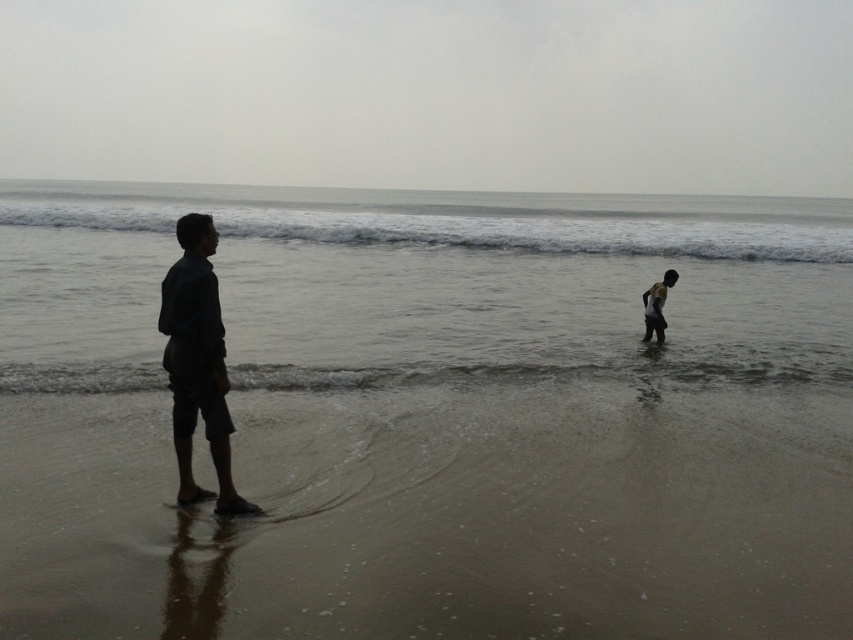
Is clear water at center positioned at the back of dark blue fabric shirt at left?

Yes, it is behind dark blue fabric shirt at left.

Can you confirm if clear water at center is smaller than dark blue fabric shirt at left?

Incorrect, clear water at center is not smaller in size than dark blue fabric shirt at left.

Is point (521, 349) farther from viewer compared to point (166, 349)?

Yes, it is behind point (166, 349).

Where is `clear water at center`? The image size is (853, 640). clear water at center is located at coordinates (422, 285).

Can you confirm if sandy beach at lower center is positioned below clear water at center?

Correct, sandy beach at lower center is located below clear water at center.

Between point (792, 522) and point (531, 275), which one is positioned behind?

The point (531, 275) is more distant.

Does point (553, 412) come in front of point (396, 205)?

Yes, it is in front of point (396, 205).

I want to click on sandy beach at lower center, so click(x=436, y=516).

How distant is clear water at center from dark skin child at lower right?

clear water at center and dark skin child at lower right are 88.36 feet apart.

Between clear water at center and dark skin child at lower right, which one is positioned lower?

dark skin child at lower right

The width and height of the screenshot is (853, 640). What do you see at coordinates (422, 285) in the screenshot? I see `clear water at center` at bounding box center [422, 285].

Where is `clear water at center`? The width and height of the screenshot is (853, 640). clear water at center is located at coordinates (422, 285).